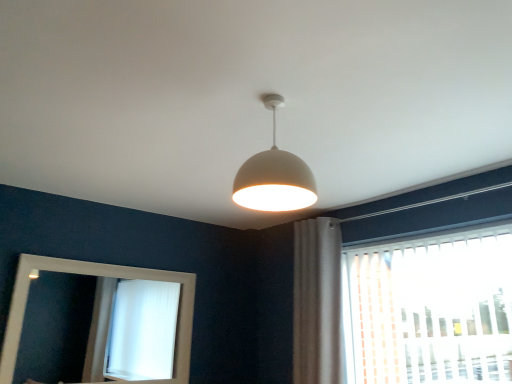
Question: Is white wooden mirror at lower left inside the boundaries of white fabric curtain at right, or outside?

Choices:
 (A) inside
 (B) outside

Answer: (B)

Question: Considering the positions of white wooden mirror at lower left and white fabric curtain at right in the image, is white wooden mirror at lower left wider or thinner than white fabric curtain at right?

Choices:
 (A) wide
 (B) thin

Answer: (B)

Question: Which of these objects is positioned closest to the white fabric curtain at right?

Choices:
 (A) white wooden mirror at lower left
 (B) white plastic blinds at right
 (C) white matte/porcelain lampshade at center

Answer: (B)

Question: Based on their relative distances, which object is farther from the white plastic blinds at right?

Choices:
 (A) white wooden mirror at lower left
 (B) white matte/porcelain lampshade at center
 (C) white fabric curtain at right

Answer: (A)